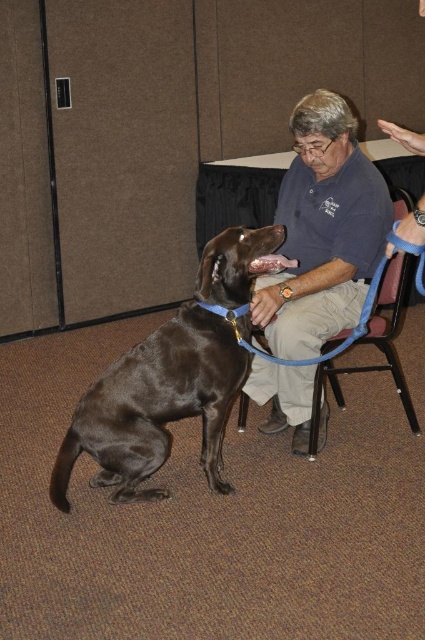
You are a photographer setting up for a portrait. You need to ensure that both the shiny brown dog at center and the matte blue shirt at center are fully visible in the frame. Based on their widths, which object might require you to adjust the camera angle or zoom to accommodate its size?

The shiny brown dog at center might be wider than the matte blue shirt at center, so adjusting the camera angle or zoom to accommodate the dog would ensure both are fully visible.

You are standing in the room and want to know which of the two points, point (207,314) or point (368,273), is closer to you. Based on the scene description, can you determine which point is nearer?

Point (207,314) is closer to the camera than point (368,273), so it is the nearer point.

You are a photographer trying to capture a clear photo of the shiny brown dog at center and the matte blue shirt at center. Which object should you focus on first to ensure both are in focus?

The shiny brown dog at center is in front of the matte blue shirt at center, so you should focus on the shiny brown dog at center first to ensure both are in focus.